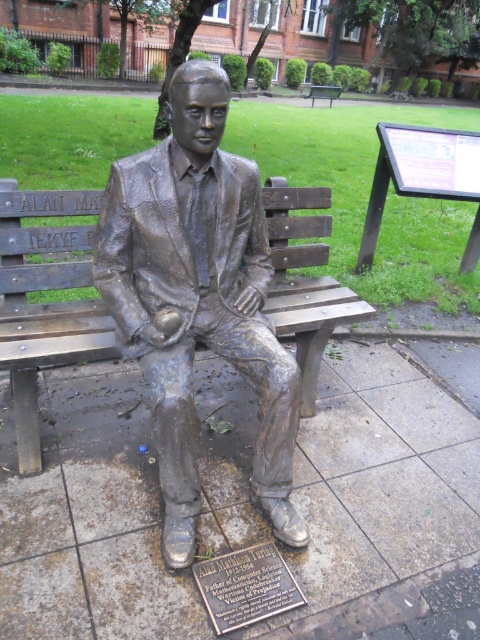
You are a tour guide explaining the Alan Turing statue to visitors. You point to two points on the statue. One is at point (x=123, y=196) and the other at point (x=236, y=577). Which point is closer to the visitors?

Point (x=123, y=196) is further to the viewer than point (x=236, y=577), so the point at (x=236, y=577) is closer to the visitors.

You are a tour guide explaining the Alan Turing statue to a group. You want to ensure everyone can see the bronze plaque at center clearly. Since the bronze wood bench at center is in the way, should you move the group closer to the statue or further away?

The bronze wood bench at center is larger than the bronze plaque at center. To ensure the group can see the bronze plaque at center clearly, you should move them further away from the statue so the bench doesn

You are a visitor at the park and want to read the bronze plaque at center. Where should you stand relative to the bronze statue at center to read it?

To read the bronze plaque at center, you should stand to the right of the bronze statue at center since the plaque is located to the right of the statue.